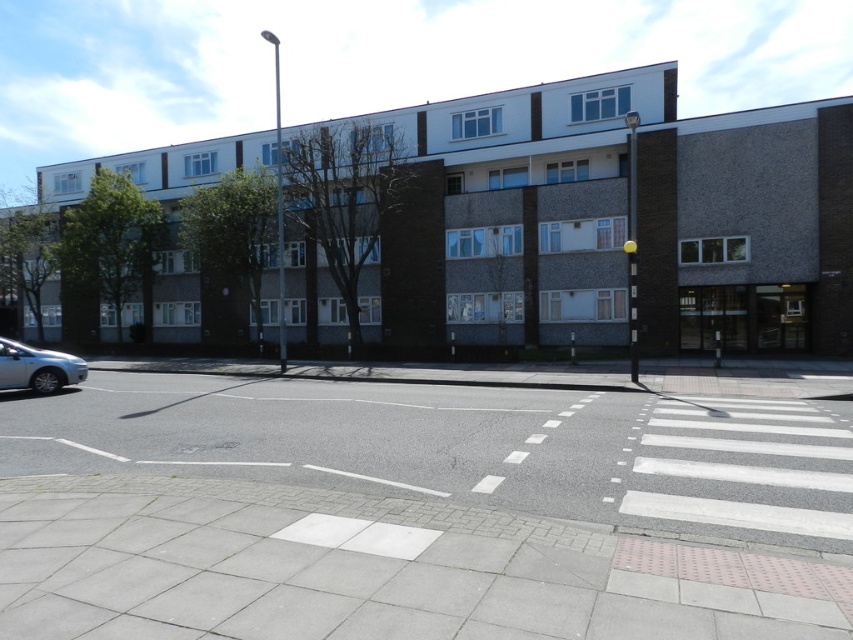
Question: Is white asphalt at center below silver metallic car at lower left?

Choices:
 (A) yes
 (B) no

Answer: (A)

Question: Is white asphalt at center behind silver metallic car at lower left?

Choices:
 (A) yes
 (B) no

Answer: (B)

Question: In this image, where is white asphalt at center located relative to silver metallic car at lower left?

Choices:
 (A) above
 (B) below

Answer: (B)

Question: Which point is closer to the camera?

Choices:
 (A) (651, 394)
 (B) (44, 369)

Answer: (A)

Question: Which point appears farthest from the camera in this image?

Choices:
 (A) (49, 352)
 (B) (664, 468)

Answer: (A)

Question: Which point is closer to the camera?

Choices:
 (A) (334, 458)
 (B) (28, 371)

Answer: (A)